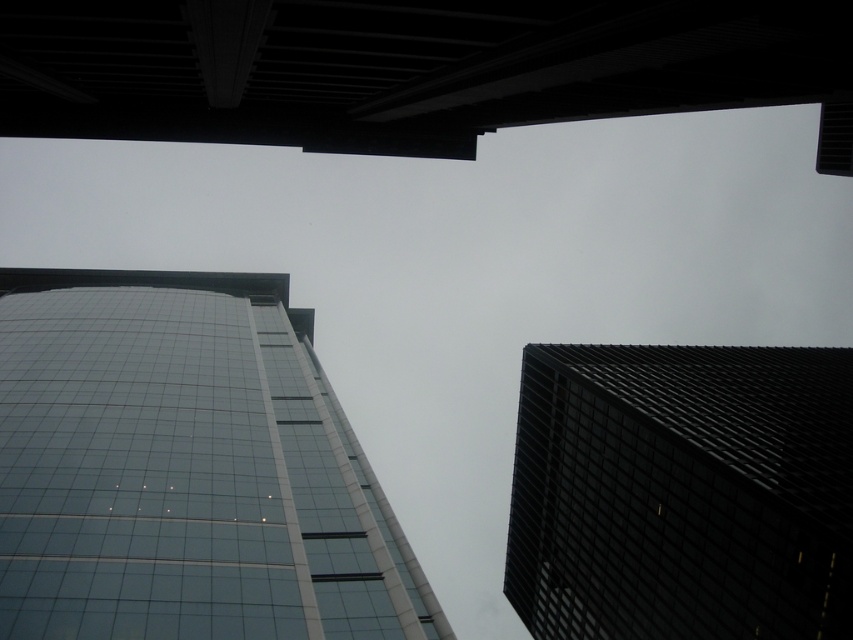
Does glassy reflective building at center appear on the left side of black textured building at right?

Yes, glassy reflective building at center is to the left of black textured building at right.

Is point (85, 323) closer to camera compared to point (682, 566)?

No, it is behind (682, 566).

Which is behind, point (276, 435) or point (821, 500)?

Positioned behind is point (276, 435).

You are a GUI agent. You are given a task and a screenshot of the screen. Output one action in this format:
    pyautogui.click(x=<x>, y=<y>)
    Task: Click on the glassy reflective building at center
    The height and width of the screenshot is (640, 853).
    Given the screenshot: What is the action you would take?
    pyautogui.click(x=184, y=468)